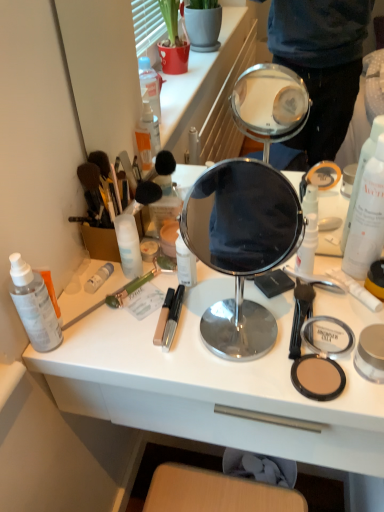
The width and height of the screenshot is (384, 512). Describe the element at coordinates (248, 429) in the screenshot. I see `white plastic drawer at lower center` at that location.

The width and height of the screenshot is (384, 512). What are the coordinates of `white plastic drawer at lower center` in the screenshot? It's located at (248, 429).

The width and height of the screenshot is (384, 512). I want to click on white matte bottle at center-left, the 3th toiletry viewed from the right, so click(128, 245).

The image size is (384, 512). Find the location of `white matte tube at left, which ranks as the third toiletry in left-to-right order`. white matte tube at left, which ranks as the third toiletry in left-to-right order is located at coordinates (99, 278).

You are a GUI agent. You are given a task and a screenshot of the screen. Output one action in this format:
    pyautogui.click(x=<x>, y=<y>)
    Task: Click on the translucent plastic spray bottle at left, which is the 2th toiletry in left-to-right order
    Image resolution: width=384 pixels, height=512 pixels.
    Given the screenshot: What is the action you would take?
    tap(50, 290)

Does point (89, 279) come behind point (98, 358)?

Yes, point (89, 279) is behind point (98, 358).

Is white matte tube at left, the 4th toiletry when ordered from right to left, in contact with white plastic desk at center?

No, white matte tube at left, the 4th toiletry when ordered from right to left, is not making contact with white plastic desk at center.

From a real-world perspective, does white matte tube at left, the 4th toiletry when ordered from right to left, stand above white plastic desk at center?

Yes.

Is translucent plastic spray bottle at left, marked as the 5th toiletry in a right-to-left arrangement, oriented towards white matte spray bottle at right?

No.

Is translucent plastic spray bottle at left, which is the 2th toiletry in left-to-right order, positioned behind white matte spray bottle at right?

Yes, translucent plastic spray bottle at left, which is the 2th toiletry in left-to-right order, is behind white matte spray bottle at right.

In the scene shown: Can we say translucent plastic spray bottle at left, marked as the 5th toiletry in a right-to-left arrangement, lies outside white matte spray bottle at right?

Yes, translucent plastic spray bottle at left, marked as the 5th toiletry in a right-to-left arrangement, is not within white matte spray bottle at right.

What's the angular difference between translucent plastic spray bottle at left, which is the 2th toiletry in left-to-right order, and white matte spray bottle at right's facing directions?

The facing directions of translucent plastic spray bottle at left, which is the 2th toiletry in left-to-right order, and white matte spray bottle at right are 0.00472 degrees apart.

Consider the image. From a real-world perspective, which is physically below, matte yellow compact powder at right, the first toiletry when ordered from right to left, or polished silver mirror at center?

matte yellow compact powder at right, the first toiletry when ordered from right to left, is physically lower.

Considering the sizes of objects matte yellow compact powder at right, placed as the 6th toiletry when sorted from left to right, and polished silver mirror at center in the image provided, who is wider, matte yellow compact powder at right, placed as the 6th toiletry when sorted from left to right, or polished silver mirror at center?

Wider between the two is polished silver mirror at center.

This screenshot has height=512, width=384. Find the location of `mirror in front of the matte yellow compact powder at right, the first toiletry when ordered from right to left`. mirror in front of the matte yellow compact powder at right, the first toiletry when ordered from right to left is located at coordinates (241, 246).

Could you tell me if matte yellow compact powder at right, placed as the 6th toiletry when sorted from left to right, is facing polished silver mirror at center?

No, matte yellow compact powder at right, placed as the 6th toiletry when sorted from left to right, is not aimed at polished silver mirror at center.

Is white plastic desk at center positioned with its back to white matte spray bottle at right?

No, white plastic desk at center is not facing the opposite direction of white matte spray bottle at right.

Based on the photo, is white plastic desk at center positioned far away from white matte spray bottle at right?

No.

Which object is positioned more to the right, white plastic desk at center or white matte spray bottle at right?

white matte spray bottle at right.

From a real-world perspective, between white plastic desk at center and white matte spray bottle at right, who is vertically higher?

white matte spray bottle at right, from a real-world perspective.

Is translucent plastic spray bottle at left, marked as the 5th toiletry in a right-to-left arrangement, to the left or to the right of white matte bottle at center-left, acting as the fourth toiletry starting from the left, in the image?

From the image, it's evident that translucent plastic spray bottle at left, marked as the 5th toiletry in a right-to-left arrangement, is to the left of white matte bottle at center-left, acting as the fourth toiletry starting from the left.

From the image's perspective, which one is positioned lower, translucent plastic spray bottle at left, marked as the 5th toiletry in a right-to-left arrangement, or white matte bottle at center-left, acting as the fourth toiletry starting from the left?

translucent plastic spray bottle at left, marked as the 5th toiletry in a right-to-left arrangement.

Would you say translucent plastic spray bottle at left, which is the 2th toiletry in left-to-right order, contains white matte bottle at center-left, the 3th toiletry viewed from the right?

Definitely not — white matte bottle at center-left, the 3th toiletry viewed from the right, is not inside translucent plastic spray bottle at left, which is the 2th toiletry in left-to-right order.

From a real-world perspective, is white matte pump bottle at right, which ranks as the 2th toiletry in right-to-left order, on translucent plastic spray bottle at left, which is the 2th toiletry in left-to-right order?

Yes, from a real-world perspective, white matte pump bottle at right, which ranks as the 2th toiletry in right-to-left order, is on top of translucent plastic spray bottle at left, which is the 2th toiletry in left-to-right order.

Is the position of white matte pump bottle at right, which ranks as the 2th toiletry in right-to-left order, less distant than that of translucent plastic spray bottle at left, marked as the 5th toiletry in a right-to-left arrangement?

That is False.

Can we say white matte pump bottle at right, which ranks as the 2th toiletry in right-to-left order, lies outside translucent plastic spray bottle at left, which is the 2th toiletry in left-to-right order?

Yes, white matte pump bottle at right, which ranks as the 2th toiletry in right-to-left order, is located beyond the bounds of translucent plastic spray bottle at left, which is the 2th toiletry in left-to-right order.

Could you tell me if white matte pump bottle at right, acting as the 5th toiletry starting from the left, is facing translucent plastic spray bottle at left, which is the 2th toiletry in left-to-right order?

No, white matte pump bottle at right, acting as the 5th toiletry starting from the left, is not turned towards translucent plastic spray bottle at left, which is the 2th toiletry in left-to-right order.

From the image's perspective, does white plastic drawer at lower center appear lower than translucent plastic spray bottle at left, which is the 2th toiletry in left-to-right order?

Yes.

Is white plastic drawer at lower center turned away from translucent plastic spray bottle at left, which is the 2th toiletry in left-to-right order?

white plastic drawer at lower center does not have its back to translucent plastic spray bottle at left, which is the 2th toiletry in left-to-right order.

In the image, is white plastic drawer at lower center positioned in front of or behind translucent plastic spray bottle at left, marked as the 5th toiletry in a right-to-left arrangement?

white plastic drawer at lower center is positioned closer to the viewer than translucent plastic spray bottle at left, marked as the 5th toiletry in a right-to-left arrangement.

How far apart are white plastic drawer at lower center and translucent plastic spray bottle at left, marked as the 5th toiletry in a right-to-left arrangement?

They are 31.89 centimeters apart.

Image resolution: width=384 pixels, height=512 pixels. Identify the location of desk below the white matte tube at left, the 4th toiletry when ordered from right to left (from a real-world perspective). (212, 386).

Find the location of a particular element. The image size is (384, 512). toiletry that is the 1st one when counting backward from the white matte spray bottle at right is located at coordinates (50, 290).

From the picture: Which object lies nearer to the anchor point matte black compact at lower right, white plastic drawer at lower center or matte yellow compact powder at right, the first toiletry when ordered from right to left?

white plastic drawer at lower center.

Which object lies further to the anchor point translucent plastic spray bottle at left, which is the 2th toiletry in left-to-right order, polished silver mirror at center or white matte spray bottle at right?

polished silver mirror at center is positioned further to the anchor translucent plastic spray bottle at left, which is the 2th toiletry in left-to-right order.

Which object lies nearer to the anchor point translucent plastic spray bottle at left, marked as the 5th toiletry in a right-to-left arrangement, white plastic desk at center or white matte spray bottle at right?

white plastic desk at center lies closer to translucent plastic spray bottle at left, marked as the 5th toiletry in a right-to-left arrangement, than the other object.

Consider the image. Considering their positions, is matte yellow compact powder at right, the first toiletry when ordered from right to left, positioned further to white matte pump bottle at right, which ranks as the 2th toiletry in right-to-left order, than white plastic drawer at lower center?

white plastic drawer at lower center is positioned further to the anchor white matte pump bottle at right, which ranks as the 2th toiletry in right-to-left order.

From the image, which object appears to be nearer to white matte spray bottle at right, white matte tube at left, the 4th toiletry when ordered from right to left, or white matte bottle at center-left, acting as the fourth toiletry starting from the left?

The object closer to white matte spray bottle at right is white matte bottle at center-left, acting as the fourth toiletry starting from the left.

From the image, which object appears to be nearer to white matte tube at left, the 4th toiletry when ordered from right to left, white matte spray bottle at right or polished silver mirror at center?

The object closer to white matte tube at left, the 4th toiletry when ordered from right to left, is white matte spray bottle at right.

Based on their spatial positions, is white matte tube at left, which ranks as the third toiletry in left-to-right order, or translucent plastic spray bottle at left, marked as the 5th toiletry in a right-to-left arrangement, further from polished silver mirror at center?

translucent plastic spray bottle at left, marked as the 5th toiletry in a right-to-left arrangement, is positioned further to the anchor polished silver mirror at center.

Considering their positions, is white plastic desk at center positioned closer to white matte spray bottle at right than polished silver mirror at center?

white plastic desk at center.

You are a GUI agent. You are given a task and a screenshot of the screen. Output one action in this format:
    pyautogui.click(x=<x>, y=<y>)
    Task: Click on the mirror between translucent plastic spray bottle at left, which is the 2th toiletry in left-to-right order, and white matte pump bottle at right, acting as the 5th toiletry starting from the left, in the horizontal direction
    This screenshot has height=512, width=384.
    Given the screenshot: What is the action you would take?
    pyautogui.click(x=241, y=246)

This screenshot has width=384, height=512. In order to click on mirror between white matte bottle at center-left, acting as the fourth toiletry starting from the left, and white matte pump bottle at right, which ranks as the 2th toiletry in right-to-left order, from left to right in this screenshot , I will do `click(241, 246)`.

The height and width of the screenshot is (512, 384). What are the coordinates of `brush between translucent plastic spray bottle at left, which is the 2th toiletry in left-to-right order, and matte black compact at lower right, in the horizontal direction` in the screenshot? It's located at (117, 295).

Locate an element on the screen. The width and height of the screenshot is (384, 512). mirror between green plastic brush at lower left and matte black compact at lower right is located at coordinates (241, 246).